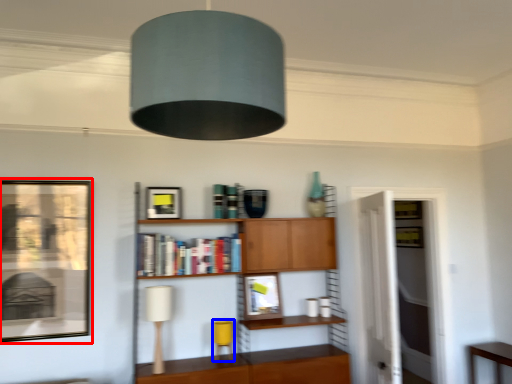
Question: Among these objects, which one is farthest to the camera, picture frame (highlighted by a red box) or table lamp (highlighted by a blue box)?

Choices:
 (A) picture frame
 (B) table lamp

Answer: (B)